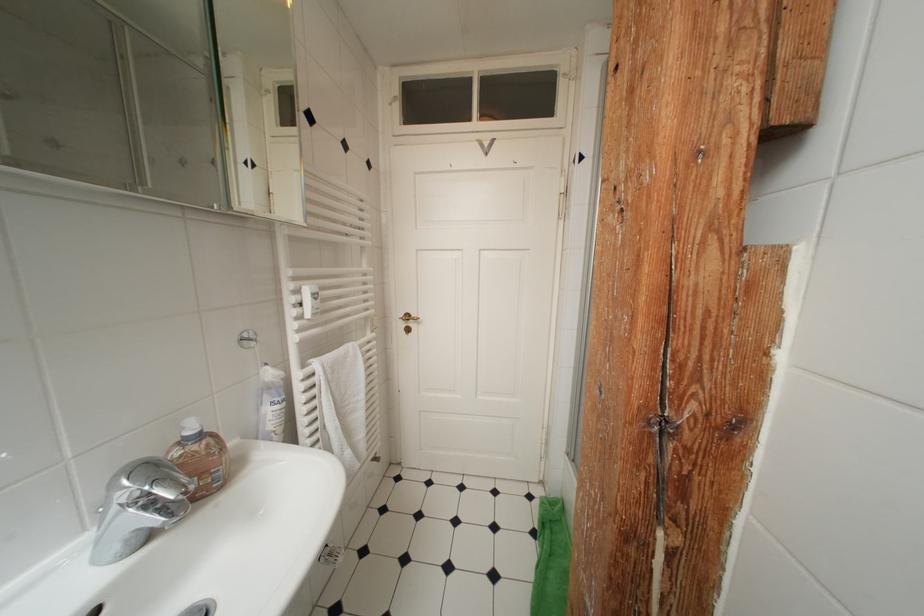
This screenshot has width=924, height=616. In order to click on gold door handle in this screenshot , I will do click(407, 318).